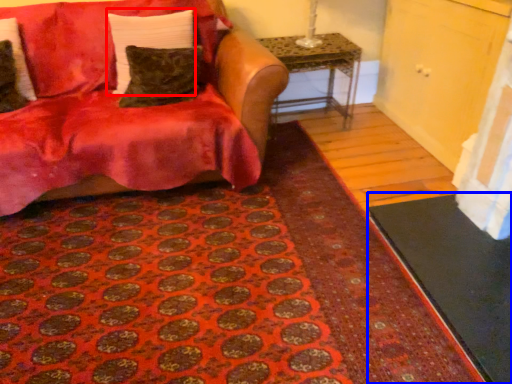
Question: Which point is further to the camera, pillow (highlighted by a red box) or doormat (highlighted by a blue box)?

Choices:
 (A) pillow
 (B) doormat

Answer: (A)